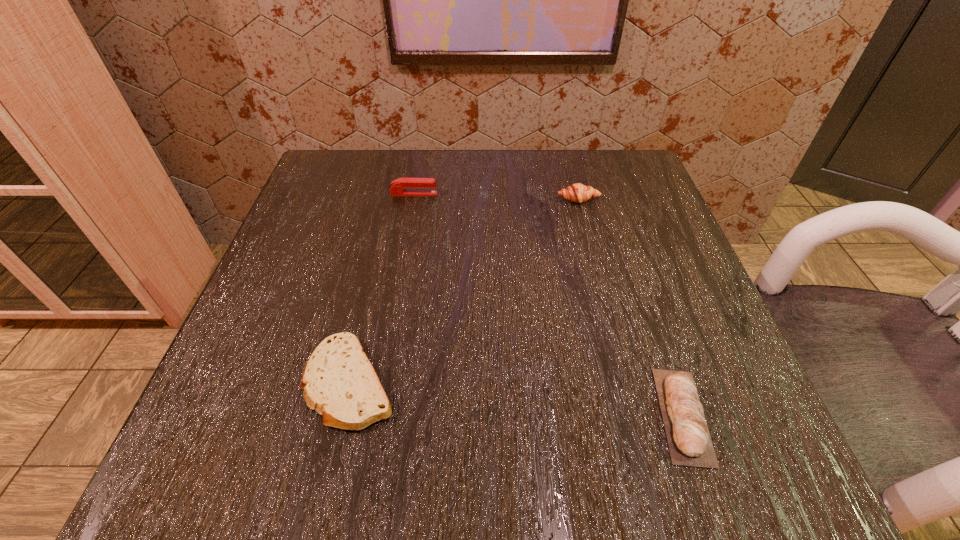
This screenshot has height=540, width=960. What are the coordinates of `vacant space in between the shorter pita bread and the stapler` in the screenshot? It's located at (382, 288).

This screenshot has height=540, width=960. Find the location of `free space between the shorter pita bread and the taller pita bread`. free space between the shorter pita bread and the taller pita bread is located at coordinates (516, 399).

Where is `free space between the left pita bread and the pastry`? free space between the left pita bread and the pastry is located at coordinates (465, 291).

I want to click on vacant area that lies between the shortest object and the pastry, so click(x=465, y=291).

The image size is (960, 540). I want to click on vacant area that lies between the pastry and the stapler, so click(496, 197).

Identify which object is located as the nearest to the stapler. Please provide its 2D coordinates. Your answer should be formatted as a tuple, i.e. [(x, y)], where the tuple contains the x and y coordinates of a point satisfying the conditions above.

[(579, 193)]

Image resolution: width=960 pixels, height=540 pixels. In order to click on the second closest object relative to the taller pita bread in this screenshot , I will do `click(579, 193)`.

I want to click on free space that satisfies the following two spatial constraints: 1. on the back side of the right pita bread; 2. on the front-facing side of the stapler, so [x=608, y=194].

The image size is (960, 540). Find the location of `vacant position in the image that satisfies the following two spatial constraints: 1. on the front-facing side of the stapler; 2. on the back side of the right pita bread`. vacant position in the image that satisfies the following two spatial constraints: 1. on the front-facing side of the stapler; 2. on the back side of the right pita bread is located at coordinates (375, 415).

Locate an element on the screen. free space that satisfies the following two spatial constraints: 1. on the front-facing side of the pastry; 2. on the left side of the taller pita bread is located at coordinates (635, 415).